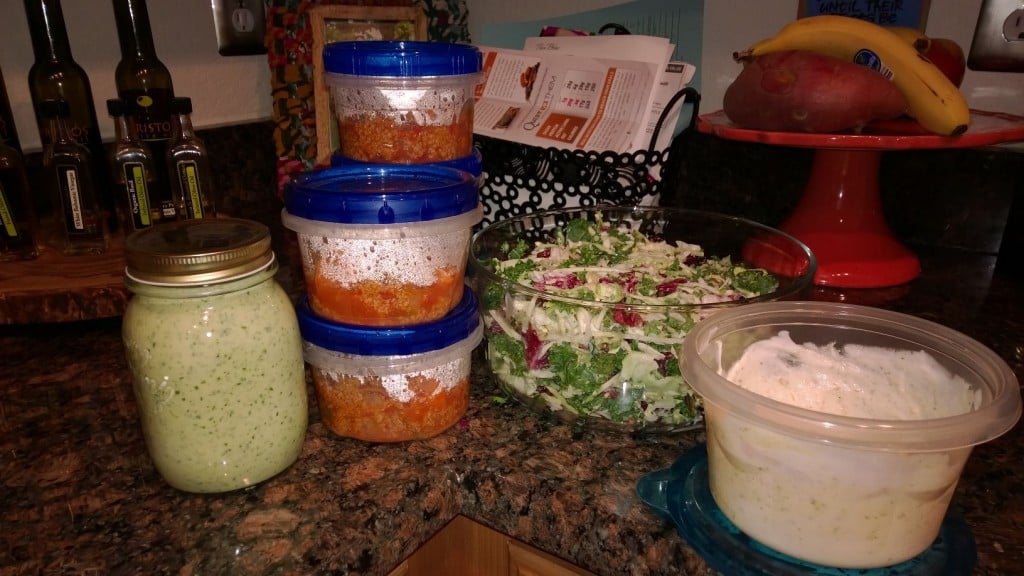
Locate an element on the screen. This screenshot has width=1024, height=576. wall is located at coordinates (214, 93), (719, 34).